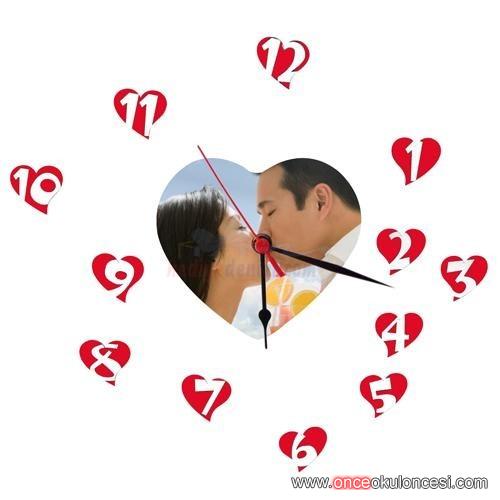
This screenshot has height=500, width=500. In order to click on clock in this screenshot , I will do `click(269, 207)`.